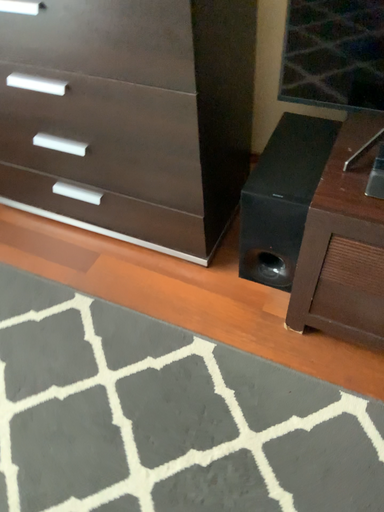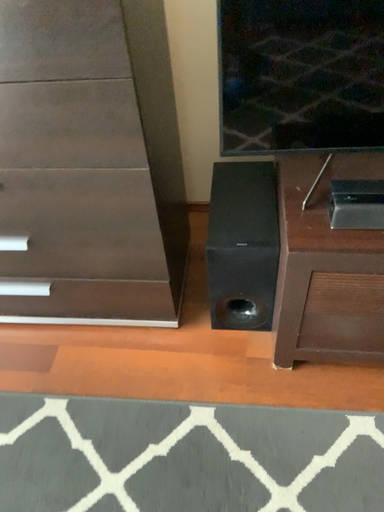
Question: How did the camera likely rotate when shooting the video?

Choices:
 (A) rotated left
 (B) rotated right

Answer: (B)